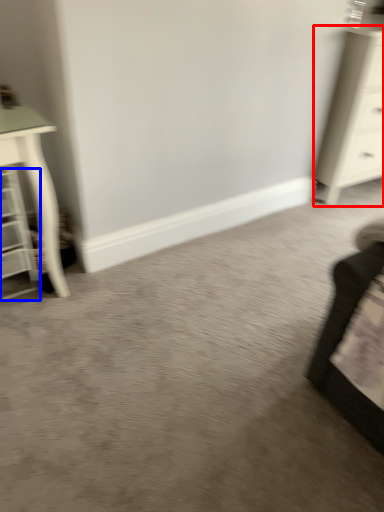
Question: Which of the following is the farthest to the observer, chest of drawers (highlighted by a red box) or shelf (highlighted by a blue box)?

Choices:
 (A) chest of drawers
 (B) shelf

Answer: (A)